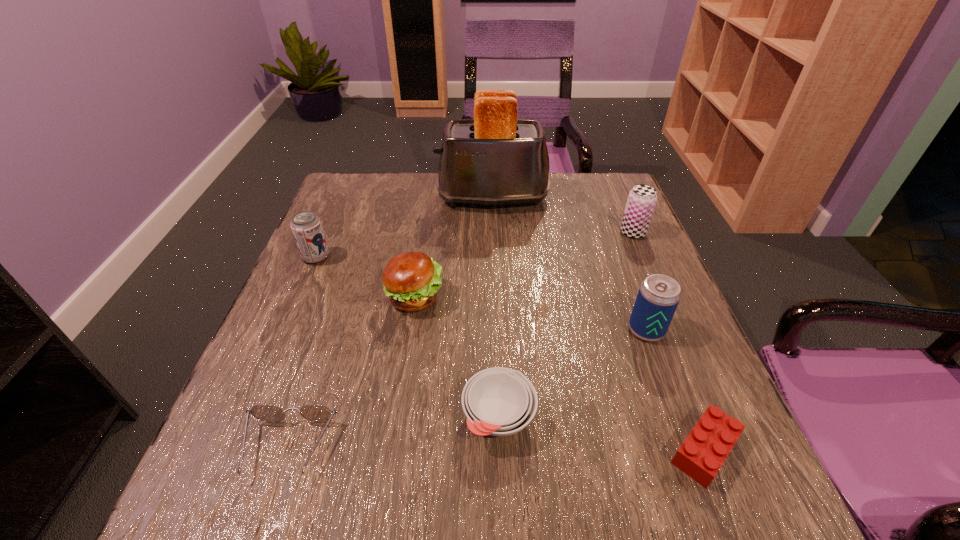
Locate an element on the screen. The height and width of the screenshot is (540, 960). vacant region located on the side of the toaster with the control lever is located at coordinates (399, 198).

Image resolution: width=960 pixels, height=540 pixels. Identify the location of vacant area situated on the side of the toaster with the control lever. (393, 198).

Find the location of a particular element. vacant area situated on the side of the toaster with the control lever is located at coordinates (349, 198).

Locate an element on the screen. Image resolution: width=960 pixels, height=540 pixels. free space located 0.190m on the front of the farthest beer can is located at coordinates (660, 295).

Where is `vacant position located on the left of the nearest beer can`? The height and width of the screenshot is (540, 960). vacant position located on the left of the nearest beer can is located at coordinates (510, 330).

Locate an element on the screen. The image size is (960, 540). vacant region located on the back of the leftmost beer can is located at coordinates (352, 174).

Where is `free spot located 0.190m on the left of the hamburger`? This screenshot has width=960, height=540. free spot located 0.190m on the left of the hamburger is located at coordinates (295, 297).

Locate an element on the screen. free region located on the back of the soup bowl is located at coordinates (493, 255).

The height and width of the screenshot is (540, 960). Identify the location of vacant space positioned on the left of the shortest object. (420, 450).

Find the location of a particular element. object that is at the far edge is located at coordinates (494, 159).